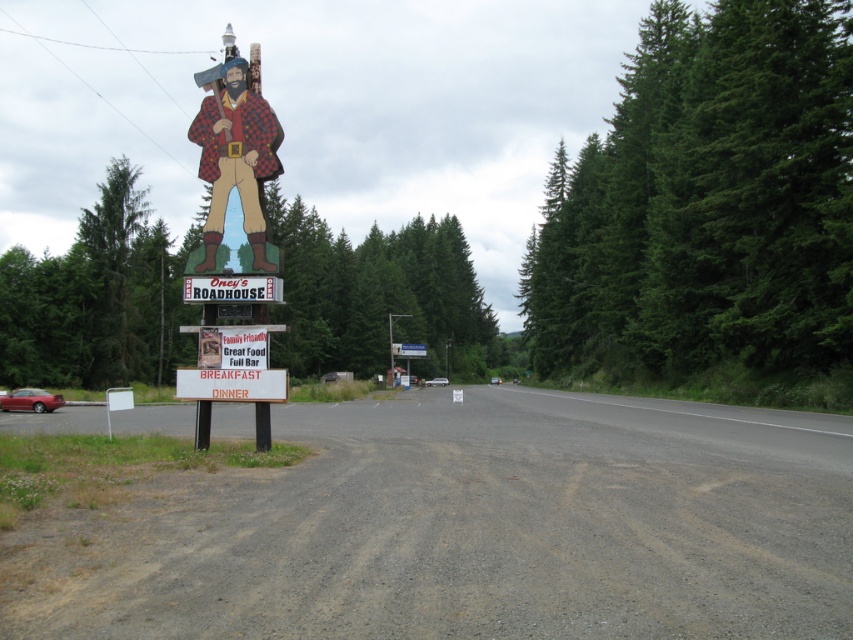
Is matte red sign at center to the left of white plastic sign at center from the viewer's perspective?

Incorrect, matte red sign at center is not on the left side of white plastic sign at center.

At what (x,y) coordinates should I click in order to perform the action: click on matte red sign at center. Please return your answer as a coordinate pair (x, y). This screenshot has width=853, height=640. Looking at the image, I should click on (231, 289).

What do you see at coordinates (231, 289) in the screenshot?
I see `matte red sign at center` at bounding box center [231, 289].

Locate an element on the screen. The width and height of the screenshot is (853, 640). matte red sign at center is located at coordinates (231, 289).

Which of these two, wooden carved figure at center or white plastic sign at center, stands shorter?

white plastic sign at center is shorter.

Find the location of a particular element. Image resolution: width=853 pixels, height=640 pixels. wooden carved figure at center is located at coordinates (235, 166).

Is wooden carved figure at center below matte red sign at center?

Actually, wooden carved figure at center is above matte red sign at center.

Can you confirm if wooden carved figure at center is bigger than matte red sign at center?

Correct, wooden carved figure at center is larger in size than matte red sign at center.

The height and width of the screenshot is (640, 853). Find the location of `wooden carved figure at center`. wooden carved figure at center is located at coordinates (235, 166).

At what (x,y) coordinates should I click in order to perform the action: click on wooden carved figure at center. Please return your answer as a coordinate pair (x, y). This screenshot has height=640, width=853. Looking at the image, I should click on (235, 166).